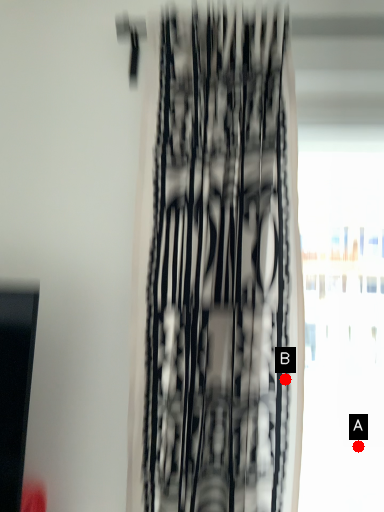
Question: Two points are circled on the image, labeled by A and B beside each circle. Which of the following is the farthest from the observer?

Choices:
 (A) A is further
 (B) B is further

Answer: (A)